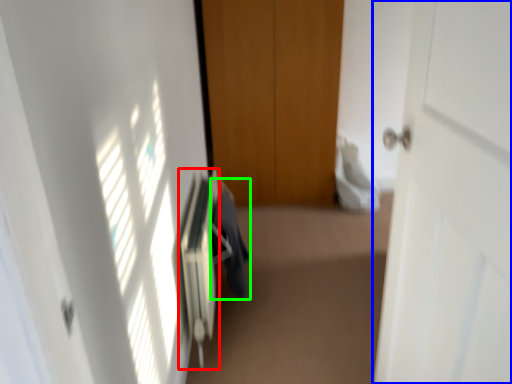
Question: Which object is positioned closest to radiator (highlighted by a red box)? Select from door (highlighted by a blue box) and laundry (highlighted by a green box).

Choices:
 (A) door
 (B) laundry

Answer: (B)